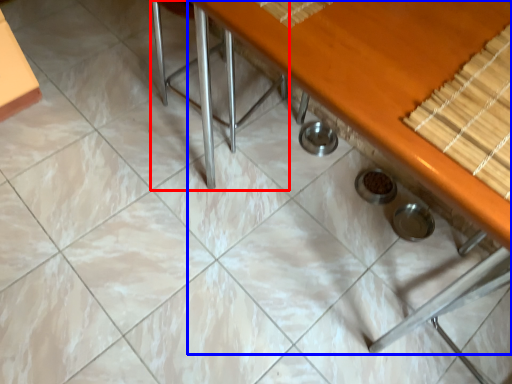
Question: Which point is closer to the camera, chair (highlighted by a red box) or table (highlighted by a blue box)?

Choices:
 (A) chair
 (B) table

Answer: (B)